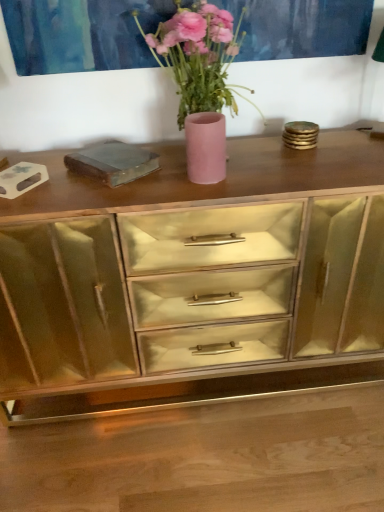
Identify the location of vacant area that is in front of matte pink vase at center. (202, 196).